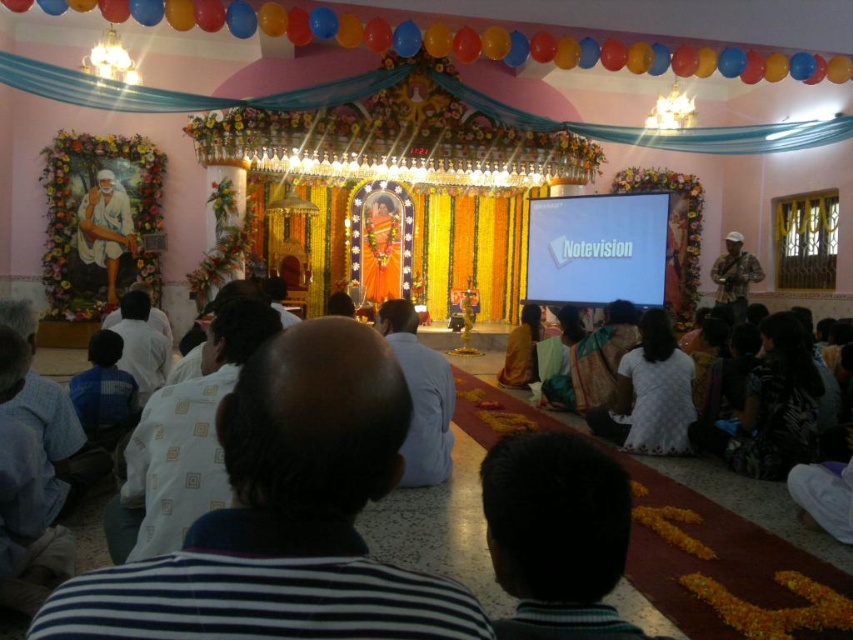
You are standing in the middle of the room and see the white clothed figure at left and the camouflage fabric shirt at right. Which one is closer to your left side?

The white clothed figure at left is closer to your left side because it is positioned to the left of the camouflage fabric shirt at right.

Looking at this image, you are standing at the entrance of the room facing the stage. Where is the white clothed figure at left located relative to the entrance?

The white clothed figure at left is located to the left side of the entrance, near the front of the room, at coordinates approximately 0.358 on the x and 0.124 on the y axis.

You are standing in the room and want to greet both the white clothed figure at left and the camouflage fabric shirt at right. Which person should you approach first to reach them in the shortest path?

You should approach the white clothed figure at left first because they are closer to you than the camouflage fabric shirt at right.